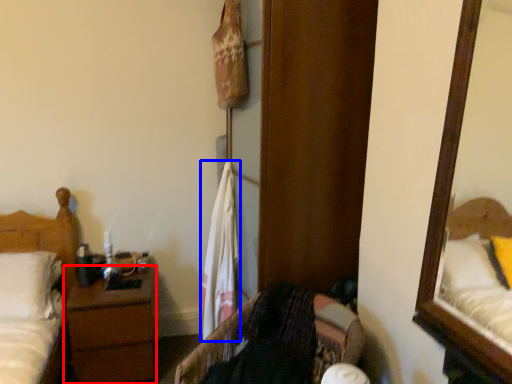
Question: Which of the following is the farthest to the observer, nightstand (highlighted by a red box) or laundry (highlighted by a blue box)?

Choices:
 (A) nightstand
 (B) laundry

Answer: (A)